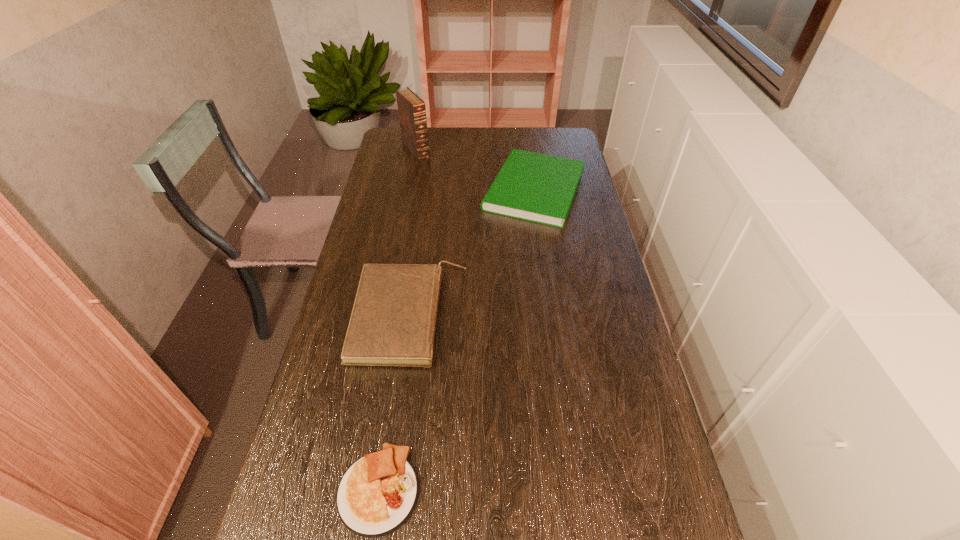
The height and width of the screenshot is (540, 960). Identify the location of Bible. (412, 113).

The width and height of the screenshot is (960, 540). Identify the location of the second tallest object. (393, 320).

Find the location of a particular element. the third farthest object is located at coordinates (393, 320).

Identify the location of the shorter paperback book. The width and height of the screenshot is (960, 540). (540, 188).

Locate an element on the screen. The image size is (960, 540). the right paperback book is located at coordinates (540, 188).

This screenshot has height=540, width=960. Find the location of `the nearest object`. the nearest object is located at coordinates (377, 494).

The image size is (960, 540). I want to click on the shortest object, so click(x=377, y=494).

Where is `free space located on the front of the tallest object`? free space located on the front of the tallest object is located at coordinates (404, 210).

Locate an element on the screen. The height and width of the screenshot is (540, 960). blank area located 0.350m on the spine side of the nearer paperback book is located at coordinates (592, 316).

Identify the location of free spot located 0.230m on the front of the shorter paperback book. (547, 278).